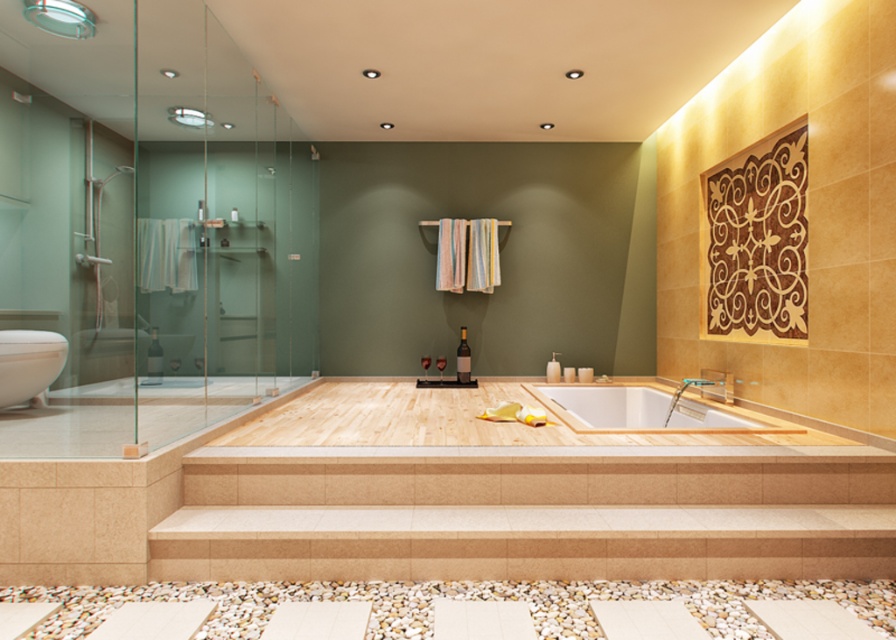
You are designing a bathroom layout and need to place a new shelf. The white wood bathtub at center is located at coordinates 0.642, 0.719. If the shelf must be placed exactly 0.1 units to the right of the bathtub, what are the coordinates for the shelf?

The coordinates for the shelf would be (643, 410) plus 0.1 to the right. Since moving right increases the x coordinate, the new coordinates are 0.642 plus 0.1 equals 0.742, so the shelf should be placed at (643, 474).

You are a delivery person who needs to place a 10 feet long package between the white wood bathtub at center and the white glossy bathtub at lower left. Can you fit the package between them without bending it?

The distance between the white wood bathtub at center and the white glossy bathtub at lower left is 9.68 feet. Since the package is 10 feet long, it is slightly longer than the available space, so you cannot fit it between them without bending it.

You are a guest in this bathroom and want to locate both the white wood bathtub at center and the white glossy bathtub at lower left. According to the scene description, which bathtub is positioned to the right of the other?

The white wood bathtub at center is to the right of white glossy bathtub at lower left.